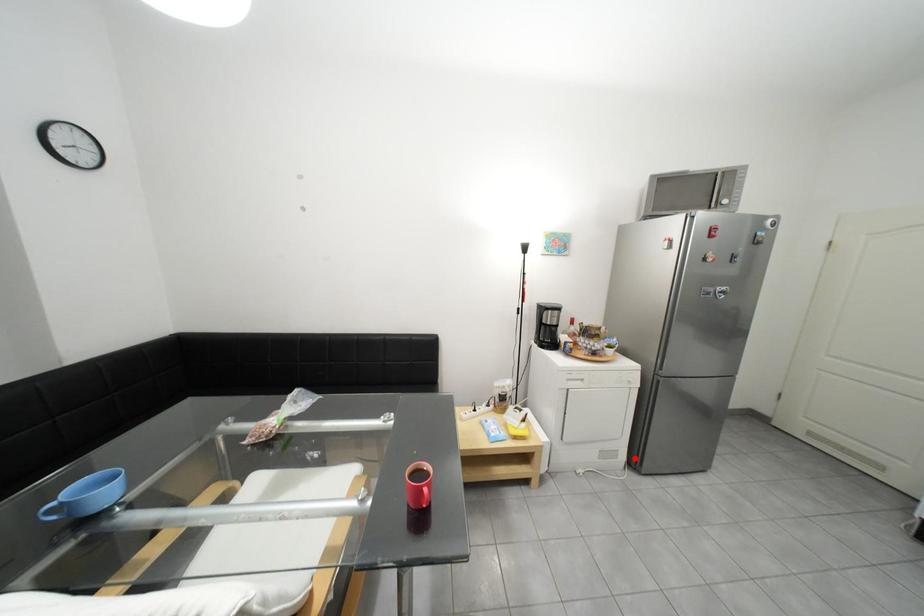
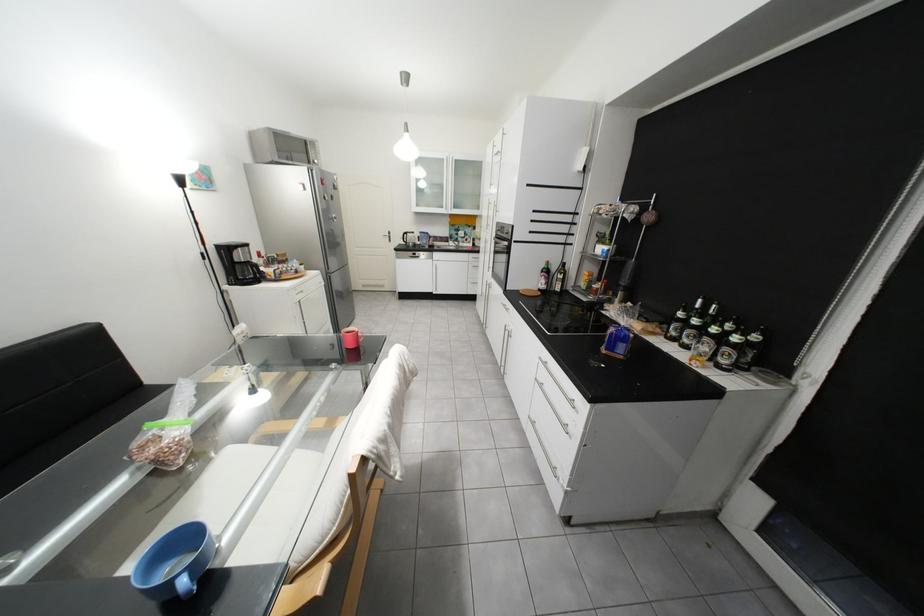
Where in the second image is the point corresponding to the highlighted location from the first image?

(343, 331)